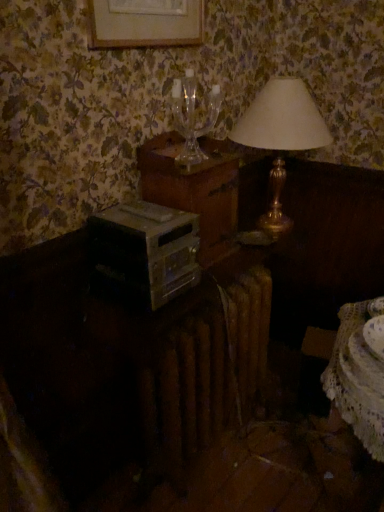
Question: Could you tell me if white lace table at lower right is turned towards silver metallic stereo at center?

Choices:
 (A) yes
 (B) no

Answer: (B)

Question: Does white lace table at lower right appear on the right side of silver metallic stereo at center?

Choices:
 (A) yes
 (B) no

Answer: (A)

Question: Does white lace table at lower right contain silver metallic stereo at center?

Choices:
 (A) yes
 (B) no

Answer: (B)

Question: Is white lace table at lower right bigger than silver metallic stereo at center?

Choices:
 (A) yes
 (B) no

Answer: (B)

Question: Would you consider white lace table at lower right to be distant from silver metallic stereo at center?

Choices:
 (A) no
 (B) yes

Answer: (A)

Question: From the image's perspective, is white lace table at lower right on top of silver metallic stereo at center?

Choices:
 (A) no
 (B) yes

Answer: (A)

Question: From a real-world perspective, is transparent glass wine glass at upper center physically below silver metallic stereo at center?

Choices:
 (A) no
 (B) yes

Answer: (A)

Question: Is transparent glass wine glass at upper center taller than silver metallic stereo at center?

Choices:
 (A) no
 (B) yes

Answer: (B)

Question: Does transparent glass wine glass at upper center lie behind silver metallic stereo at center?

Choices:
 (A) no
 (B) yes

Answer: (B)

Question: Is transparent glass wine glass at upper center wider than silver metallic stereo at center?

Choices:
 (A) yes
 (B) no

Answer: (B)

Question: From the image's perspective, is transparent glass wine glass at upper center located beneath silver metallic stereo at center?

Choices:
 (A) yes
 (B) no

Answer: (B)

Question: Would you say transparent glass wine glass at upper center is a long distance from silver metallic stereo at center?

Choices:
 (A) yes
 (B) no

Answer: (B)

Question: Does white lace table at lower right come behind transparent glass wine glass at upper center?

Choices:
 (A) yes
 (B) no

Answer: (B)